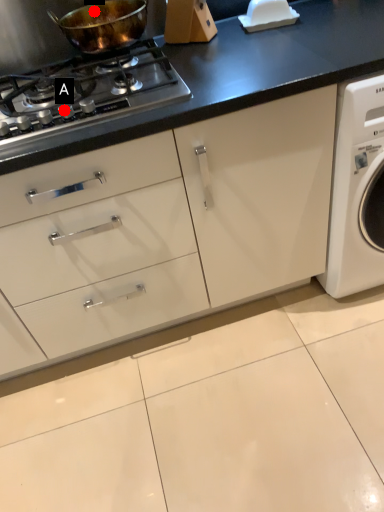
Question: Two points are circled on the image, labeled by A and B beside each circle. Which of the following is the farthest from the observer?

Choices:
 (A) A is further
 (B) B is further

Answer: (B)